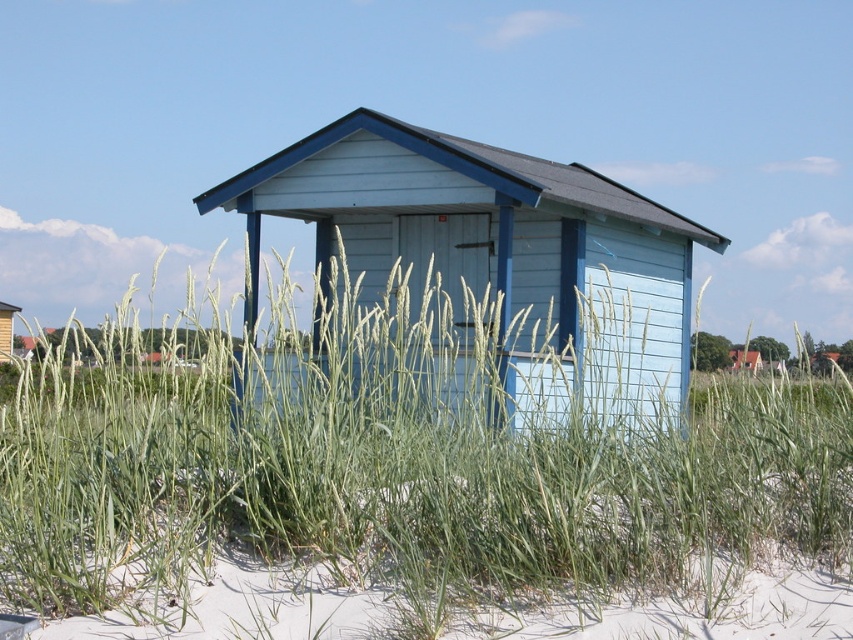
Is the position of green grass at center more distant than that of matte blue wooden hut at center?

No, it is in front of matte blue wooden hut at center.

Which is more to the right, green grass at center or matte blue wooden hut at center?

green grass at center is more to the right.

Is point (587, 547) behind point (4, 305)?

No, (587, 547) is closer to viewer.

I want to click on green grass at center, so click(392, 477).

The height and width of the screenshot is (640, 853). What do you see at coordinates (392, 477) in the screenshot?
I see `green grass at center` at bounding box center [392, 477].

Does green grass at center have a greater width compared to light blue wood cabin at center?

Yes.

Between point (187, 476) and point (456, 161), which one is positioned in front?

Point (187, 476)

At what (x,y) coordinates should I click in order to perform the action: click on green grass at center. Please return your answer as a coordinate pair (x, y). Looking at the image, I should click on pos(392,477).

Between light blue wood cabin at center and matte blue wooden hut at center, which one appears on the left side from the viewer's perspective?

matte blue wooden hut at center is more to the left.

Does light blue wood cabin at center have a greater height compared to matte blue wooden hut at center?

Yes.

Describe the element at coordinates (489, 266) in the screenshot. This screenshot has height=640, width=853. I see `light blue wood cabin at center` at that location.

The height and width of the screenshot is (640, 853). I want to click on light blue wood cabin at center, so click(489, 266).